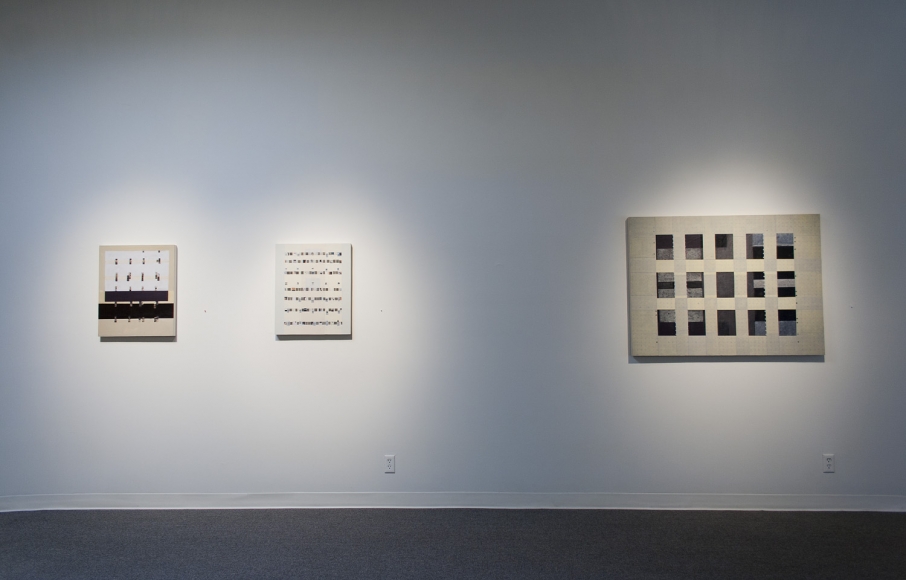
Identify the location of skirting board. (477, 501).